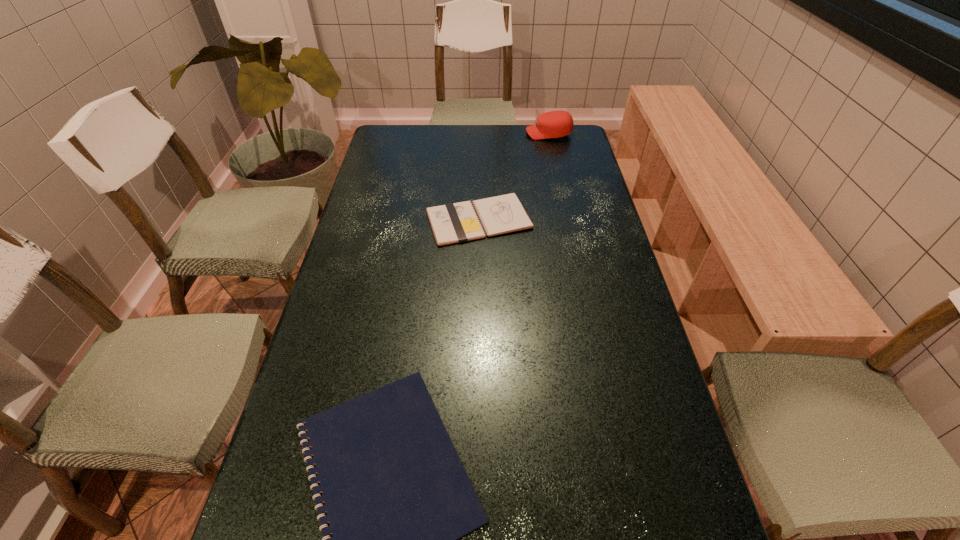
Locate an element on the screen. Image resolution: width=960 pixels, height=540 pixels. free spot that satisfies the following two spatial constraints: 1. on the front-facing side of the rightmost object; 2. on the front side of the taller notepad is located at coordinates (567, 220).